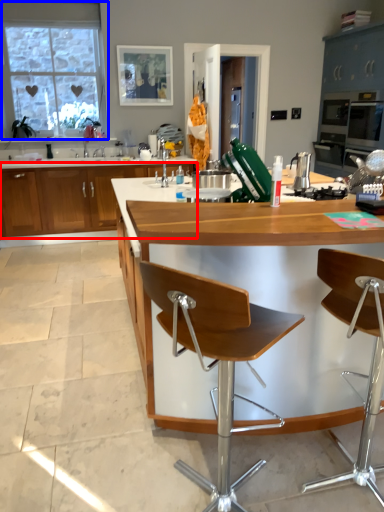
Question: Among these objects, which one is nearest to the camera, cabinetry (highlighted by a red box) or window (highlighted by a blue box)?

Choices:
 (A) cabinetry
 (B) window

Answer: (A)